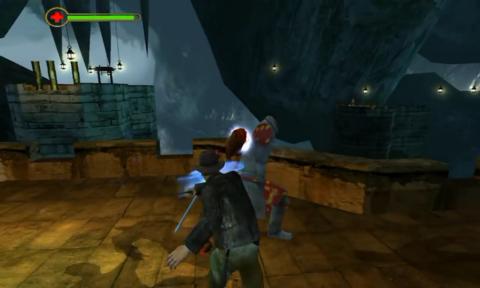
The height and width of the screenshot is (288, 480). What are the coordinates of `table` in the screenshot? It's located at (328, 189).